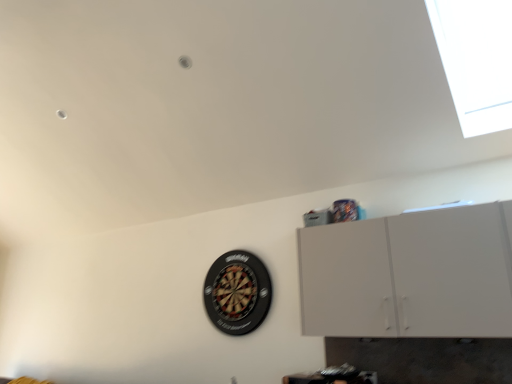
Question: Is white matte cabinet at upper right turned away from black plastic dartboard at center?

Choices:
 (A) yes
 (B) no

Answer: (B)

Question: From the image's perspective, is white matte cabinet at upper right beneath black plastic dartboard at center?

Choices:
 (A) no
 (B) yes

Answer: (A)

Question: Is white matte cabinet at upper right thinner than black plastic dartboard at center?

Choices:
 (A) yes
 (B) no

Answer: (B)

Question: Can you confirm if white matte cabinet at upper right is positioned to the right of black plastic dartboard at center?

Choices:
 (A) yes
 (B) no

Answer: (A)

Question: From a real-world perspective, is white matte cabinet at upper right below black plastic dartboard at center?

Choices:
 (A) yes
 (B) no

Answer: (B)

Question: Is white matte cabinet at upper right behind black plastic dartboard at center?

Choices:
 (A) no
 (B) yes

Answer: (A)

Question: Is black plastic dartboard at center taller than white matte cabinet at upper right?

Choices:
 (A) yes
 (B) no

Answer: (B)

Question: Is black plastic dartboard at center facing towards white matte cabinet at upper right?

Choices:
 (A) no
 (B) yes

Answer: (A)

Question: Can you confirm if black plastic dartboard at center is thinner than white matte cabinet at upper right?

Choices:
 (A) no
 (B) yes

Answer: (B)

Question: Would you say black plastic dartboard at center contains white matte cabinet at upper right?

Choices:
 (A) yes
 (B) no

Answer: (B)

Question: Is black plastic dartboard at center at the left side of white matte cabinet at upper right?

Choices:
 (A) yes
 (B) no

Answer: (A)

Question: Considering the relative sizes of black plastic dartboard at center and white matte cabinet at upper right in the image provided, is black plastic dartboard at center shorter than white matte cabinet at upper right?

Choices:
 (A) yes
 (B) no

Answer: (A)

Question: Is black plastic dartboard at center wider than transparent glass window at upper right?

Choices:
 (A) no
 (B) yes

Answer: (A)